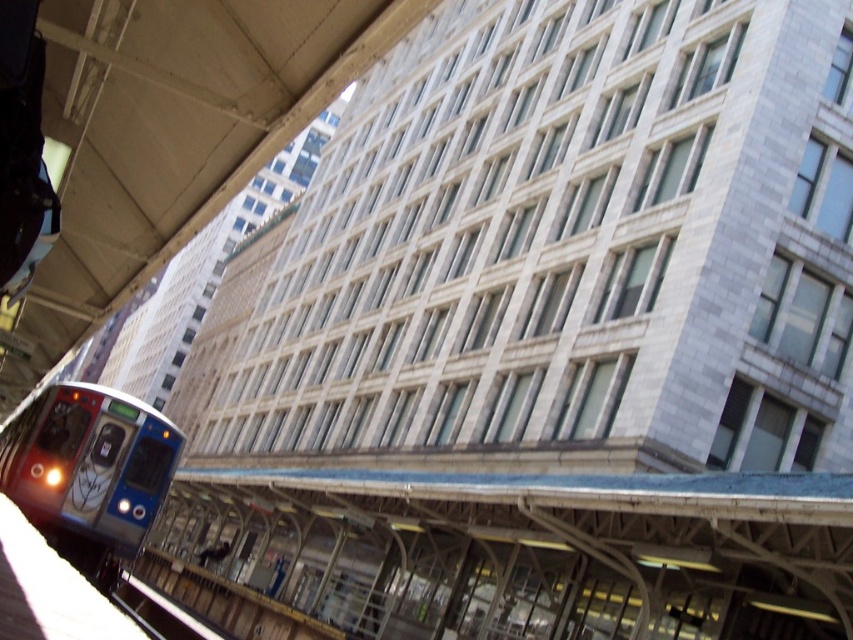
Question: Does metallic blue train at lower left have a greater width compared to black metal train track at lower left?

Choices:
 (A) no
 (B) yes

Answer: (B)

Question: Which point is closer to the camera?

Choices:
 (A) (158, 445)
 (B) (216, 634)

Answer: (A)

Question: Which object is farther from the camera taking this photo?

Choices:
 (A) metallic blue train at lower left
 (B) black metal train track at lower left

Answer: (B)

Question: Which object is farther from the camera taking this photo?

Choices:
 (A) black metal train track at lower left
 (B) metallic blue train at lower left

Answer: (A)

Question: Is metallic blue train at lower left smaller than black metal train track at lower left?

Choices:
 (A) yes
 (B) no

Answer: (B)

Question: Can you confirm if metallic blue train at lower left is positioned to the left of black metal train track at lower left?

Choices:
 (A) yes
 (B) no

Answer: (A)